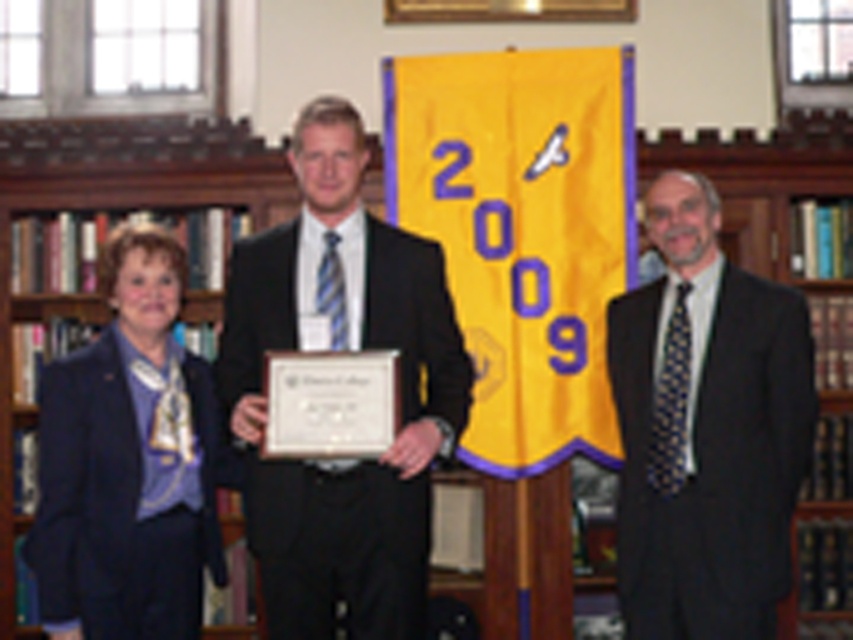
You are standing at the entrance of the event hall and want to approach the person in the matte black suit at center. Which direction should you move to reach them first, considering the position of the matte black blazer at left?

The matte black suit at center is in front of the matte black blazer at left, so you should move towards the center direction to reach the matte black suit at center first before the matte black blazer at left.

You are standing in the room and want to determine which of the two points, point (x=363, y=275) or point (x=663, y=192), is closer to you. Based on the scene, which point is nearer?

Point (x=363, y=275) is closer to the camera than point (x=663, y=192), so it is the nearer point.

You are attending a formal event and need to find the tallest person wearing a dark suit. Based on the image, which individual is the tallest between the matte black suit at center and the dark gray suit at right?

The matte black suit at center is much taller than the dark gray suit at right, so the tallest person is the one wearing the matte black suit at center.